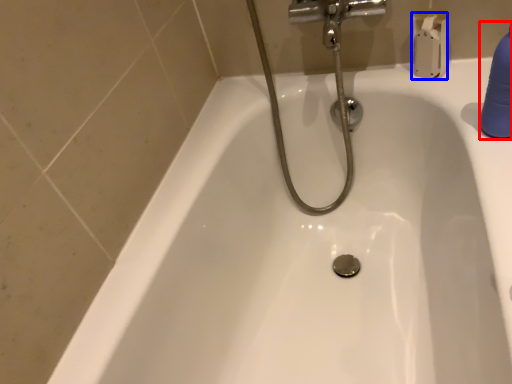
Question: Which object is closer to the camera taking this photo, cleaning product (highlighted by a red box) or toilet paper (highlighted by a blue box)?

Choices:
 (A) cleaning product
 (B) toilet paper

Answer: (A)